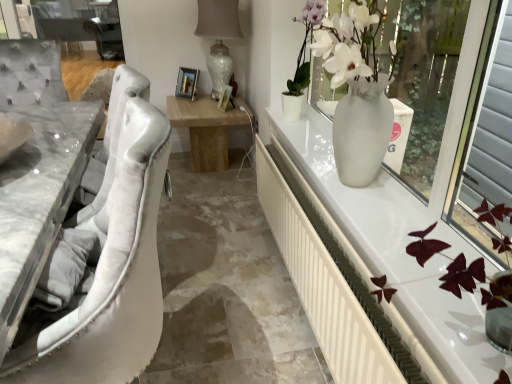
Question: Considering the positions of white plastic radiator at right and white marble table at left in the image, is white plastic radiator at right taller or shorter than white marble table at left?

Choices:
 (A) tall
 (B) short

Answer: (A)

Question: From the image's perspective, is white plastic radiator at right above or below white marble table at left?

Choices:
 (A) below
 (B) above

Answer: (A)

Question: Which object is positioned closest to the white glossy vase at upper right?

Choices:
 (A) white glossy vase at right
 (B) white plastic radiator at right
 (C) white marble table at left

Answer: (B)

Question: Which of these objects is positioned closest to the white plastic radiator at right?

Choices:
 (A) white marble table at left
 (B) white glossy vase at right
 (C) white glossy vase at upper right

Answer: (C)